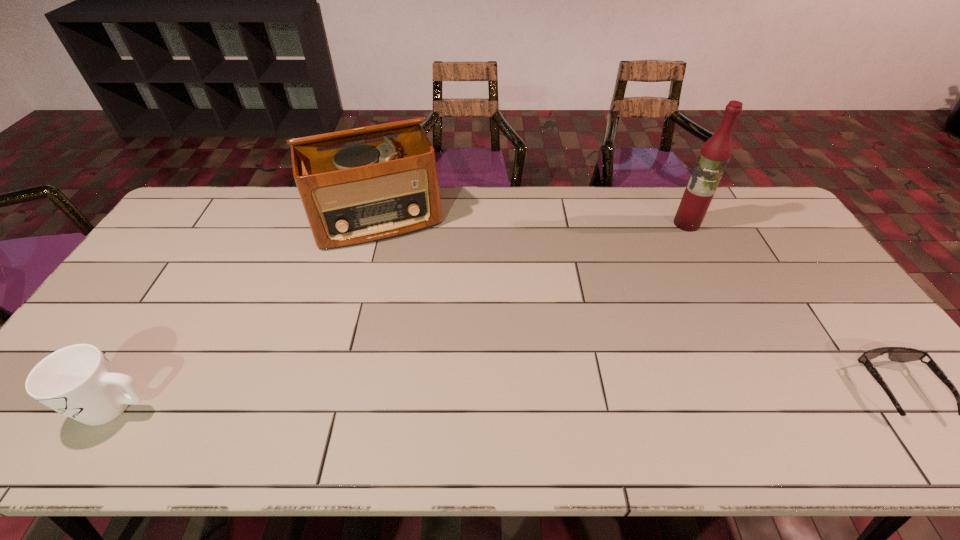
You are a GUI agent. You are given a task and a screenshot of the screen. Output one action in this format:
    pyautogui.click(x=<x>, y=<y>)
    Task: Click on the free location located on the label of the liquor
    This screenshot has width=960, height=540.
    Given the screenshot: What is the action you would take?
    648,285

The height and width of the screenshot is (540, 960). Find the location of `radio receiver that is at the far edge`. radio receiver that is at the far edge is located at coordinates (371, 191).

Identify the location of liquor that is positioned at the far edge. The image size is (960, 540). (715, 153).

In order to click on object that is at the near edge in this screenshot , I will do `click(78, 381)`.

You are a GUI agent. You are given a task and a screenshot of the screen. Output one action in this format:
    pyautogui.click(x=<x>, y=<y>)
    Task: Click on the object at the left edge
    This screenshot has height=540, width=960.
    Given the screenshot: What is the action you would take?
    pyautogui.click(x=78, y=381)

At what (x,y) coordinates should I click in order to perform the action: click on object that is positioned at the near left corner. Please return your answer as a coordinate pair (x, y). The image size is (960, 540). Looking at the image, I should click on 78,381.

In the image, there is a desktop. Where is `blank space at the far edge`? The height and width of the screenshot is (540, 960). blank space at the far edge is located at coordinates (519, 217).

Locate an element on the screen. Image resolution: width=960 pixels, height=540 pixels. free spot at the near edge of the desktop is located at coordinates (786, 404).

This screenshot has height=540, width=960. What are the coordinates of `free region at the left edge` in the screenshot? It's located at (124, 329).

At what (x,y) coordinates should I click in order to perform the action: click on free region at the right edge of the desktop. Please return your answer as a coordinate pair (x, y). Image resolution: width=960 pixels, height=540 pixels. Looking at the image, I should click on (827, 355).